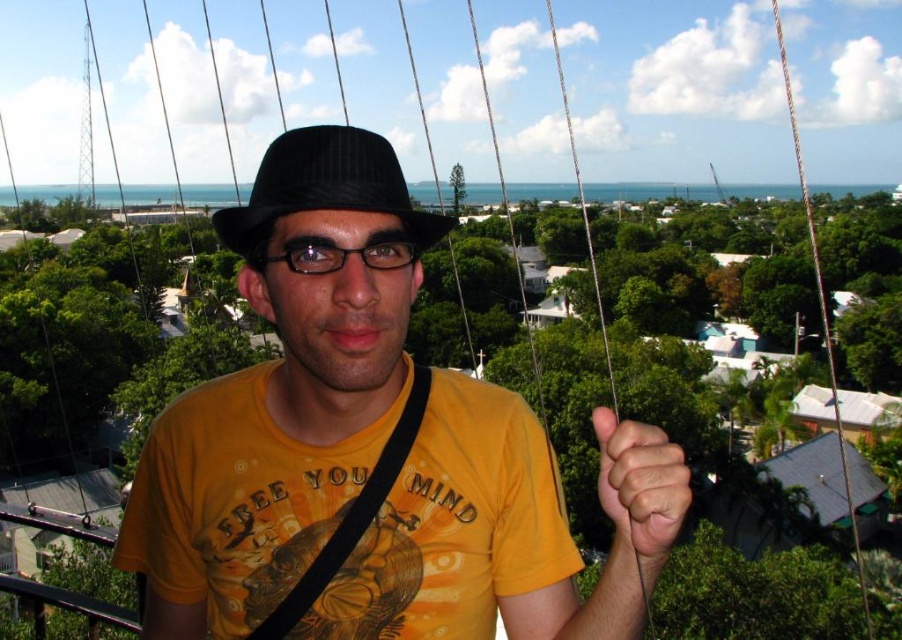
Question: Among these points, which one is farthest from the camera?

Choices:
 (A) (296, 614)
 (B) (672, 502)
 (C) (867, 627)
 (D) (560, 97)

Answer: (D)

Question: Is black pinstripe fedora at center wider than metallic wire at upper right?

Choices:
 (A) yes
 (B) no

Answer: (B)

Question: Which object is farther from the camera taking this photo?

Choices:
 (A) black fabric strap at center
 (B) metallic wire at upper right
 (C) matte black hat at center

Answer: (B)

Question: Considering the relative positions of black pinstripe fedora at center and smooth skin hand at center in the image provided, where is black pinstripe fedora at center located with respect to smooth skin hand at center?

Choices:
 (A) right
 (B) left

Answer: (B)

Question: Which object appears closest to the camera in this image?

Choices:
 (A) black pinstripe fedora at center
 (B) matte black hat at center
 (C) metallic wire at upper right

Answer: (B)

Question: Is smooth skin hand at center further to the viewer compared to black fabric strap at center?

Choices:
 (A) yes
 (B) no

Answer: (B)